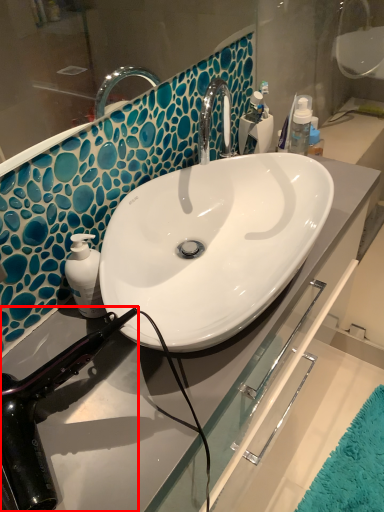
Question: From the image's perspective, what is the correct spatial relationship of hair drier (annotated by the red box) in relation to toiletry?

Choices:
 (A) above
 (B) below

Answer: (B)